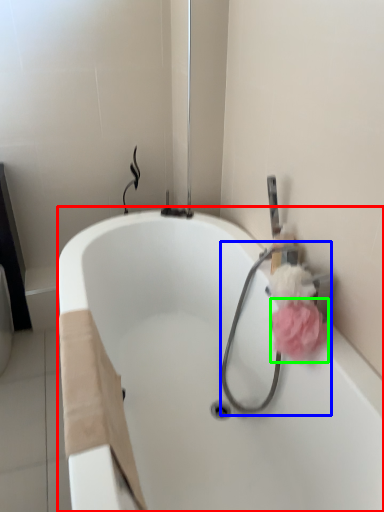
Question: Which object is the closest to the bathtub (highlighted by a red box)? Choose among these: garden hose (highlighted by a blue box) or flower (highlighted by a green box).

Choices:
 (A) garden hose
 (B) flower

Answer: (A)